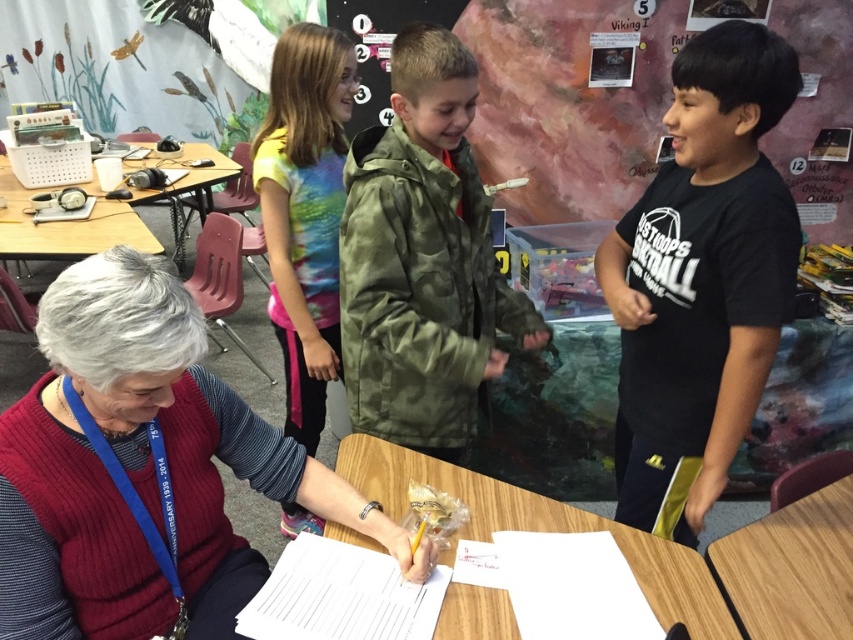
In the scene shown: You are a tailor measuring the distance between two points in the classroom. The ribbed sweater at center is one point, and the wooden desk is the other. Can you fit a 36 inch long tape measure between them without it overlapping either object?

Yes, because the distance between the ribbed sweater at center and the wooden desk is 37.16 inches, which is longer than the 36 inch tape measure. The tape measure can fit between them without overlapping.

You are a student who needs to place a heavy textbook on a surface that can support it. Given the wooden table at center and the wooden table at left, which one is more likely to be sturdy based on their height difference?

The wooden table at left is taller than the wooden table at center, so it is more likely to be sturdy and capable of supporting the heavy textbook.